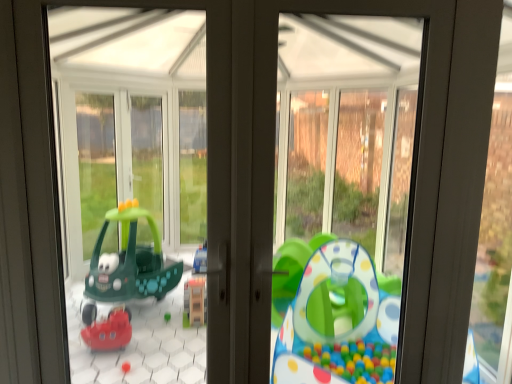
Question: Is green plastic toy boat at left to the right of matte gray window frame at right from the viewer's perspective?

Choices:
 (A) yes
 (B) no

Answer: (B)

Question: Can you confirm if green plastic toy boat at left is bigger than matte gray window frame at right?

Choices:
 (A) yes
 (B) no

Answer: (B)

Question: Is green plastic toy boat at left placed right next to matte gray window frame at right?

Choices:
 (A) no
 (B) yes

Answer: (A)

Question: From a real-world perspective, is green plastic toy boat at left under matte gray window frame at right?

Choices:
 (A) yes
 (B) no

Answer: (B)

Question: Is green plastic toy boat at left in front of matte gray window frame at right?

Choices:
 (A) yes
 (B) no

Answer: (A)

Question: Is matte gray window frame at right completely or partially inside green plastic toy boat at left?

Choices:
 (A) no
 (B) yes

Answer: (A)

Question: Does matte gray window frame at right appear on the right side of green plastic toy boat at left?

Choices:
 (A) no
 (B) yes

Answer: (B)

Question: Is matte gray window frame at right facing towards green plastic toy boat at left?

Choices:
 (A) yes
 (B) no

Answer: (B)

Question: Is matte gray window frame at right positioned beyond the bounds of green plastic toy boat at left?

Choices:
 (A) no
 (B) yes

Answer: (B)

Question: Considering the relative positions of matte gray window frame at right and green plastic toy boat at left in the image provided, is matte gray window frame at right to the left of green plastic toy boat at left from the viewer's perspective?

Choices:
 (A) no
 (B) yes

Answer: (A)

Question: From a real-world perspective, is matte gray window frame at right on green plastic toy boat at left?

Choices:
 (A) no
 (B) yes

Answer: (A)

Question: Is matte gray window frame at right oriented away from green plastic toy boat at left?

Choices:
 (A) no
 (B) yes

Answer: (A)

Question: From the image's perspective, is matte gray window frame at right above or below green plastic toy boat at left?

Choices:
 (A) below
 (B) above

Answer: (A)